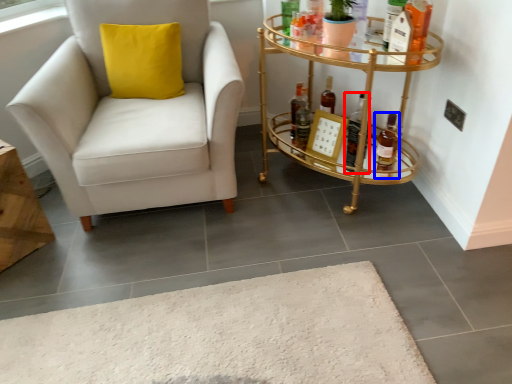
Question: Among these objects, which one is nearest to the camera, bottle (highlighted by a red box) or bottle (highlighted by a blue box)?

Choices:
 (A) bottle
 (B) bottle

Answer: (B)